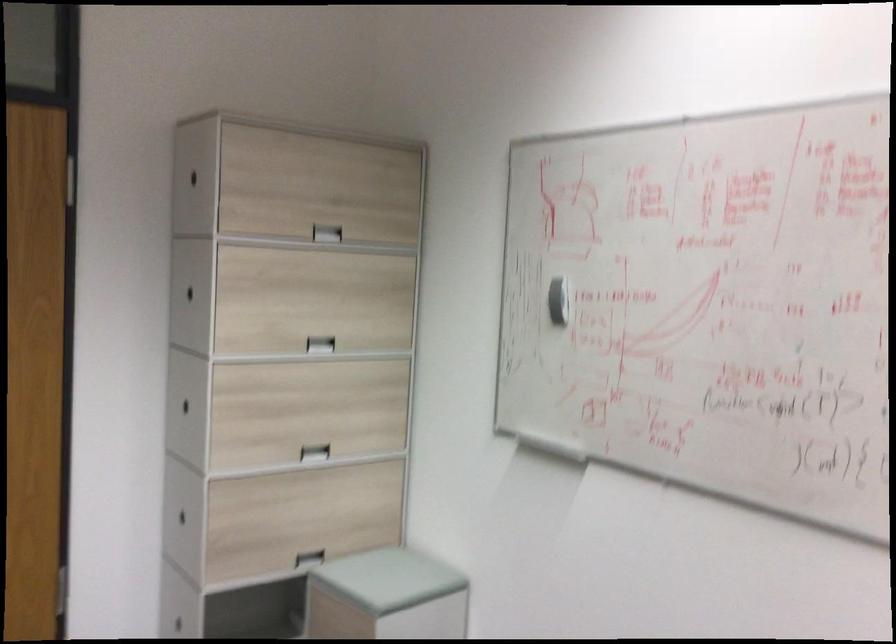
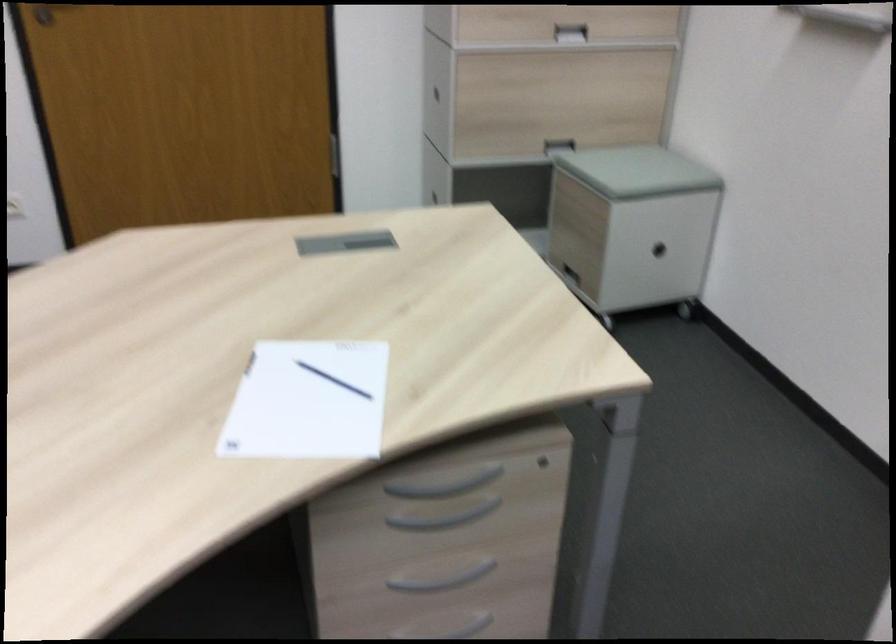
Where in the second image is the point corresponding to (312,456) from the first image?

(570, 33)